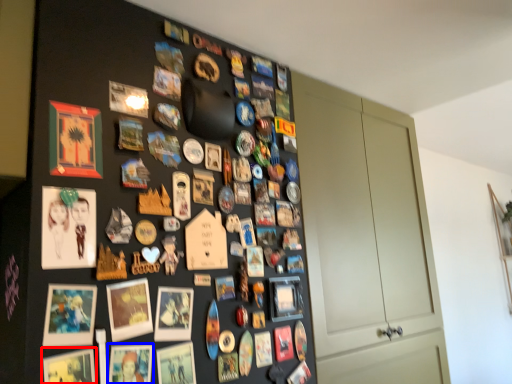
Question: Which point is further to the camera, picture frame (highlighted by a red box) or picture frame (highlighted by a blue box)?

Choices:
 (A) picture frame
 (B) picture frame

Answer: (B)